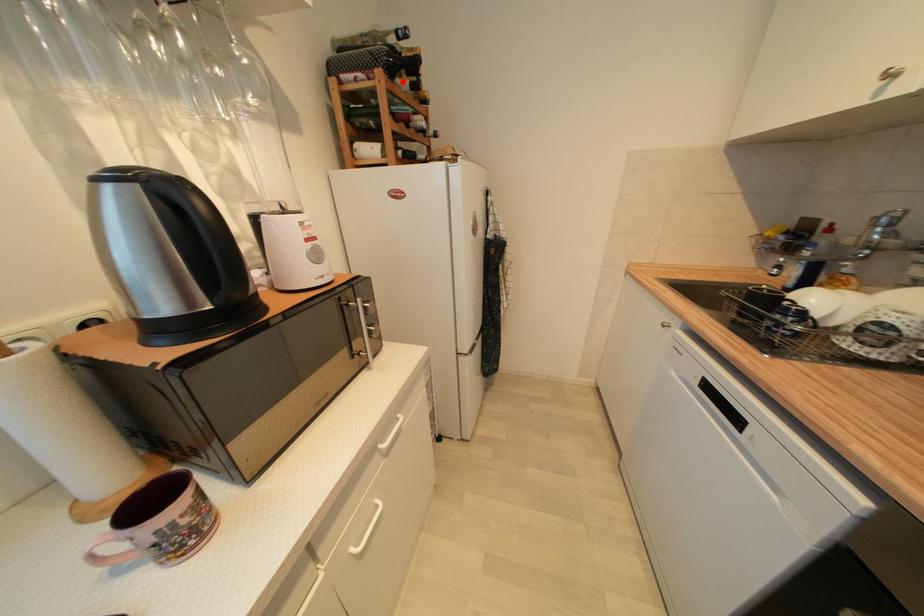
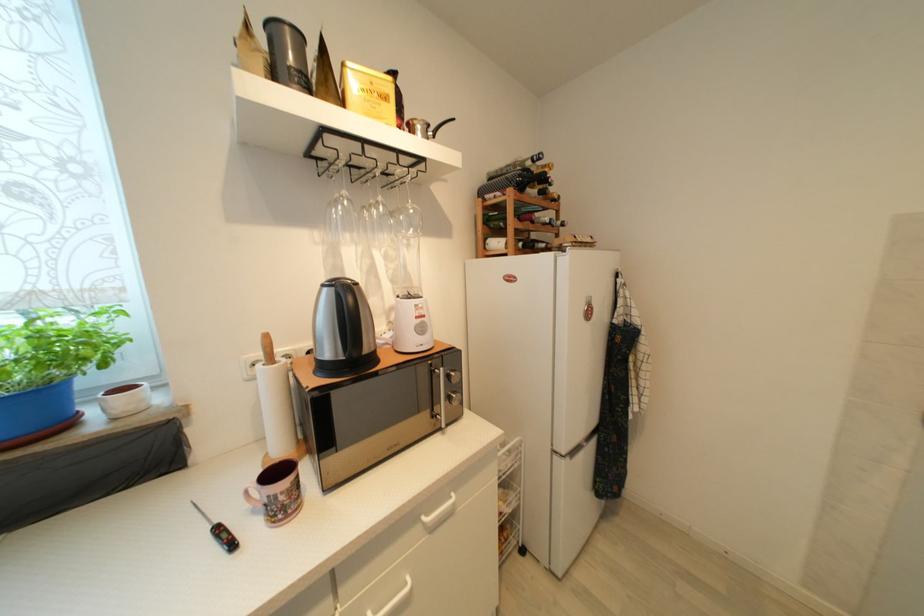
Where in the second image is the point corresponding to the highlighted location from the first image?

(533, 192)